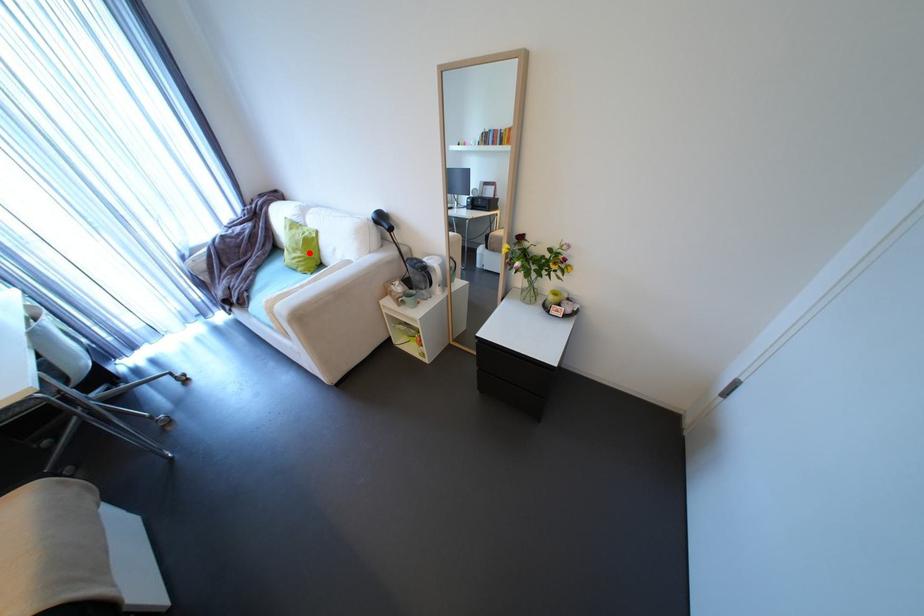
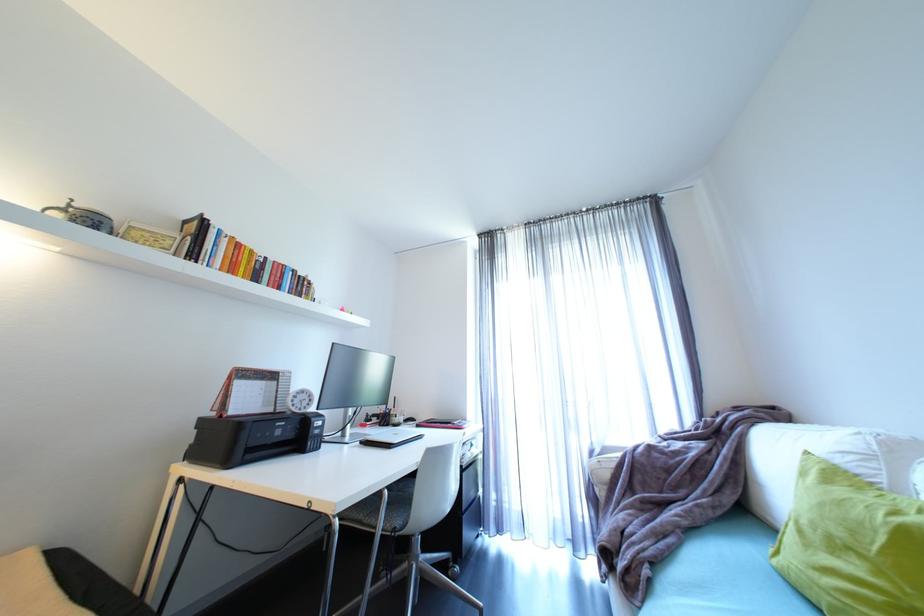
Find the pixel in the second image that matches the highlighted location in the first image.

(885, 573)